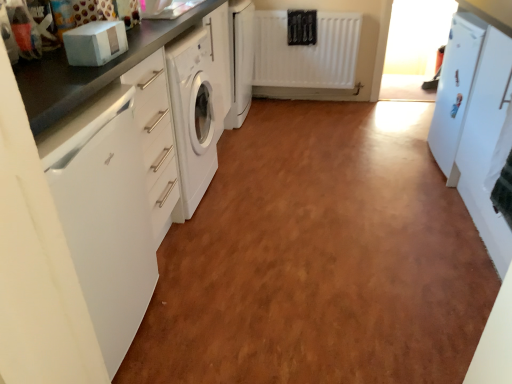
The width and height of the screenshot is (512, 384). I want to click on vacant space situated on the left part of white matte refrigerator at right, arranged as the 1th cabinetry when ordered from the bottom, so pyautogui.click(x=388, y=252).